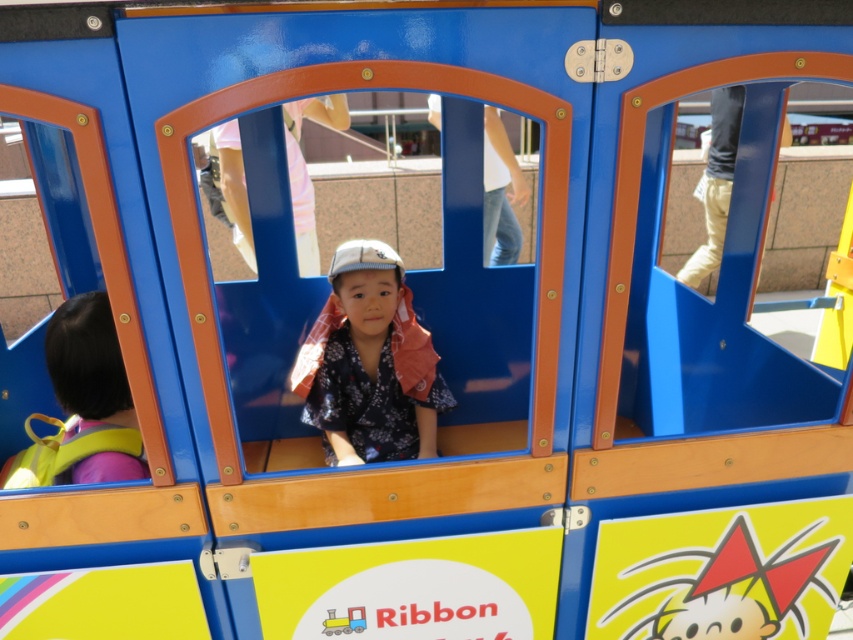
Which of these two, floral fabric kimono at center or yellow fabric backpack at left, stands taller?

floral fabric kimono at center is taller.

Where is `floral fabric kimono at center`? This screenshot has height=640, width=853. floral fabric kimono at center is located at coordinates (370, 364).